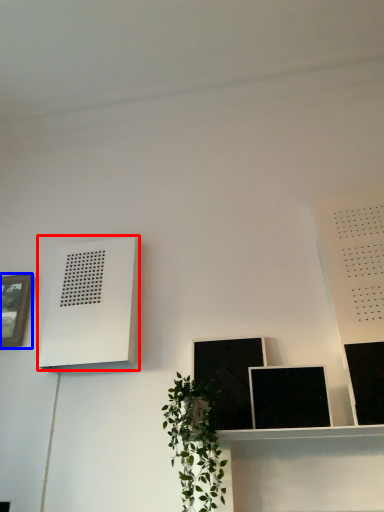
Question: Which object is closer to the camera taking this photo, air conditioner (highlighted by a red box) or picture frame (highlighted by a blue box)?

Choices:
 (A) air conditioner
 (B) picture frame

Answer: (A)